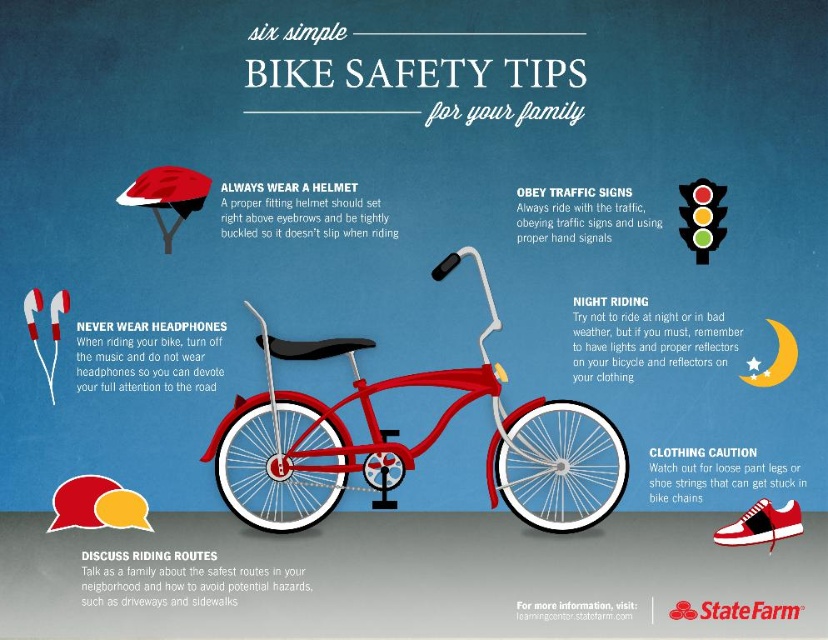
Question: Does shiny metallic bicycle at center appear over red leather shoe at lower right?

Choices:
 (A) yes
 (B) no

Answer: (A)

Question: Where is shiny metallic bicycle at center located in relation to red leather shoe at lower right in the image?

Choices:
 (A) left
 (B) right

Answer: (A)

Question: Which object is the farthest from the shiny metallic bicycle at center?

Choices:
 (A) red leather shoe at lower right
 (B) black plastic traffic light at upper right

Answer: (B)

Question: Is shiny metallic bicycle at center smaller than red leather shoe at lower right?

Choices:
 (A) no
 (B) yes

Answer: (A)

Question: Which is nearer to the shiny metallic bicycle at center?

Choices:
 (A) red leather shoe at lower right
 (B) black plastic traffic light at upper right

Answer: (A)

Question: Which point appears farthest from the camera in this image?

Choices:
 (A) (753, 544)
 (B) (566, 509)
 (C) (697, 205)

Answer: (B)